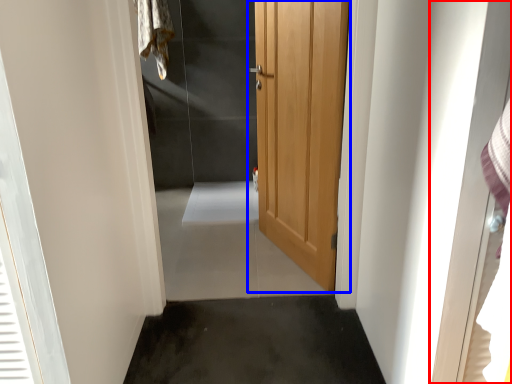
Question: Among these objects, which one is nearest to the camera, screen door (highlighted by a red box) or door (highlighted by a blue box)?

Choices:
 (A) screen door
 (B) door

Answer: (A)